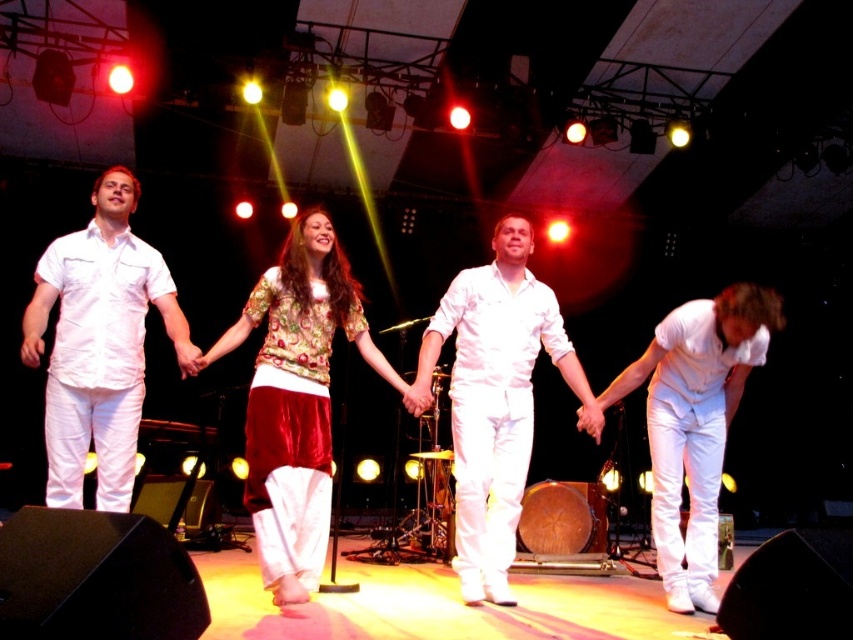
Question: Can you confirm if velvet floral top at center is positioned to the right of white satin pants at lower right?

Choices:
 (A) no
 (B) yes

Answer: (A)

Question: Which object is closer to the camera taking this photo?

Choices:
 (A) white satin pants at lower right
 (B) velvet floral top at center
 (C) white satin pants at left

Answer: (C)

Question: Does velvet floral top at center have a lesser width compared to white satin pants at left?

Choices:
 (A) yes
 (B) no

Answer: (B)

Question: Which object is closer to the camera taking this photo?

Choices:
 (A) white satin pants at left
 (B) white satin pants at lower right
 (C) velvet floral top at center
 (D) white satin jumpsuit at center

Answer: (A)

Question: Can you confirm if velvet floral top at center is thinner than white satin pants at lower right?

Choices:
 (A) no
 (B) yes

Answer: (B)

Question: Estimate the real-world distances between objects in this image. Which object is closer to the white satin jumpsuit at center?

Choices:
 (A) velvet floral top at center
 (B) white satin pants at lower right
 (C) white satin pants at left

Answer: (B)